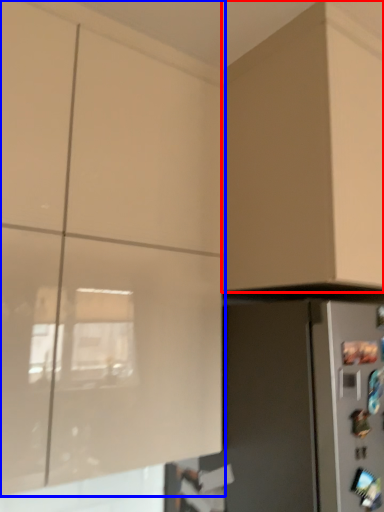
Question: Among these objects, which one is farthest to the camera, cabinetry (highlighted by a red box) or cabinetry (highlighted by a blue box)?

Choices:
 (A) cabinetry
 (B) cabinetry

Answer: (A)